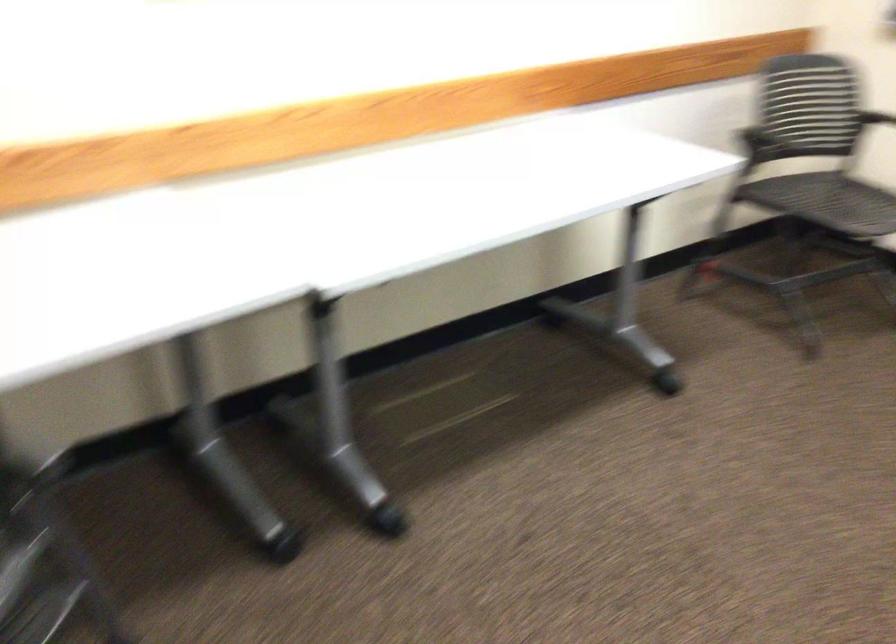
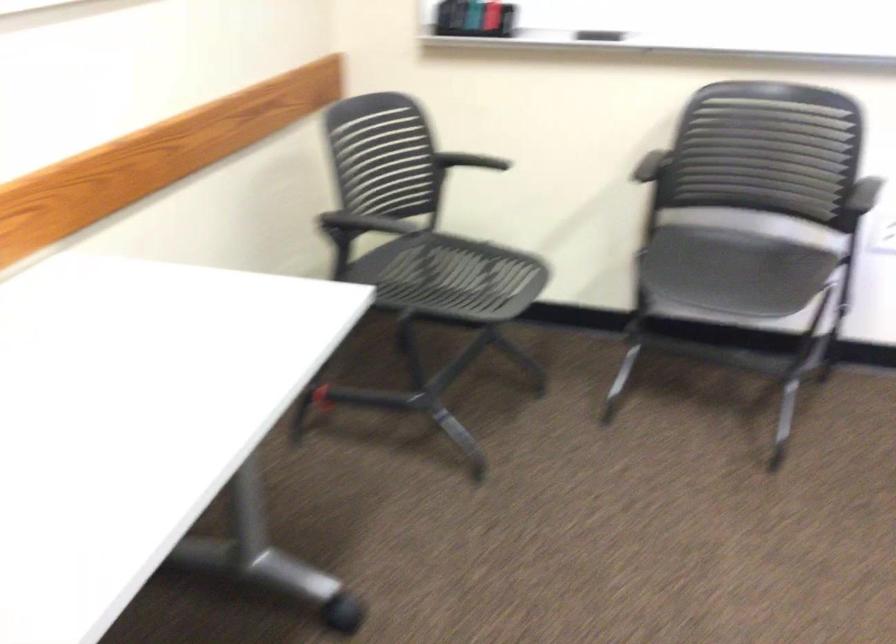
Question: The images are taken continuously from a first-person perspective. In which direction is your viewpoint rotating?

Choices:
 (A) Left
 (B) Right
 (C) Up
 (D) Down

Answer: (B)